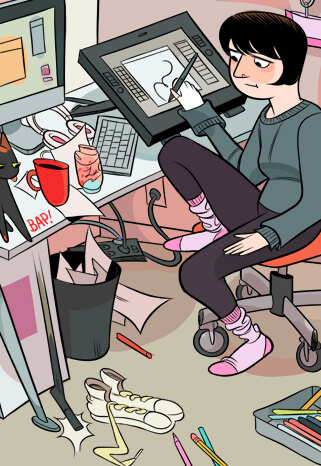
I want to click on trashcan, so click(x=92, y=298).